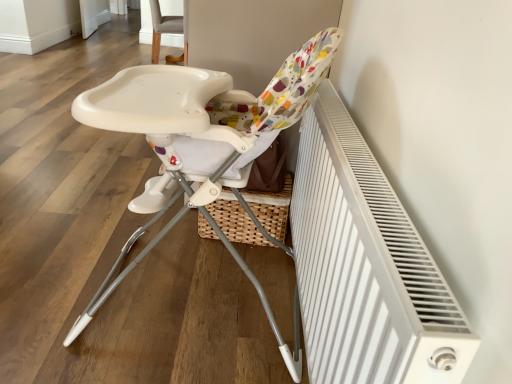
Question: Looking at the image, does gray fabric chair at upper center, the second chair from the front, seem bigger or smaller compared to white plastic highchair at center, positioned as the first chair in front-to-back order?

Choices:
 (A) small
 (B) big

Answer: (A)

Question: Is gray fabric chair at upper center, the 1th chair from the back, inside the boundaries of white plastic highchair at center, positioned as the first chair in front-to-back order, or outside?

Choices:
 (A) outside
 (B) inside

Answer: (A)

Question: Which object is the farthest from the white textured radiator at right?

Choices:
 (A) white plastic highchair at center, the 2th chair from the back
 (B) gray fabric chair at upper center, the second chair from the front

Answer: (B)

Question: Considering the real-world distances, which object is closest to the white plastic highchair at center, the 2th chair from the back?

Choices:
 (A) gray fabric chair at upper center, the second chair from the front
 (B) white textured radiator at right

Answer: (B)